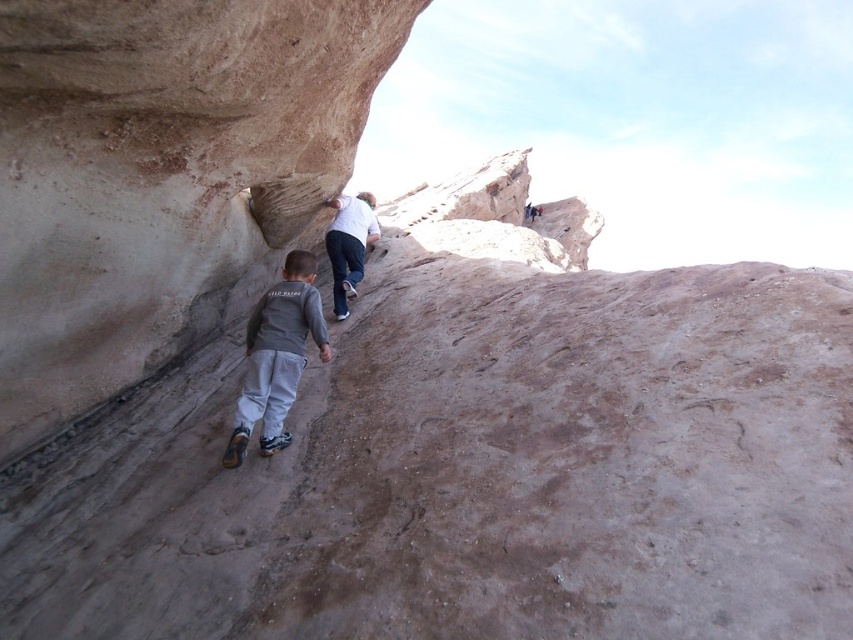
You are a photographer trying to capture a clear photo of both the gray fabric pants at lower center and the white matte shirt at upper center. Since the camera can only focus on one object at a time, which object should you focus on to ensure the other is still in the background?

You should focus on the gray fabric pants at lower center because it is closer to the viewer, allowing the white matte shirt at upper center to remain in the background.

You are a photographer standing at the camera position. You want to capture a closeup shot of the point marked at coordinates (306, 84). Given that your camera can focus on objects within 25 feet, will you be able to take the photo without moving?

The point at coordinates (306, 84) is 24.76 feet away from the camera. Since this distance is within the camera focus range of 25 feet, you can take the photo without moving.